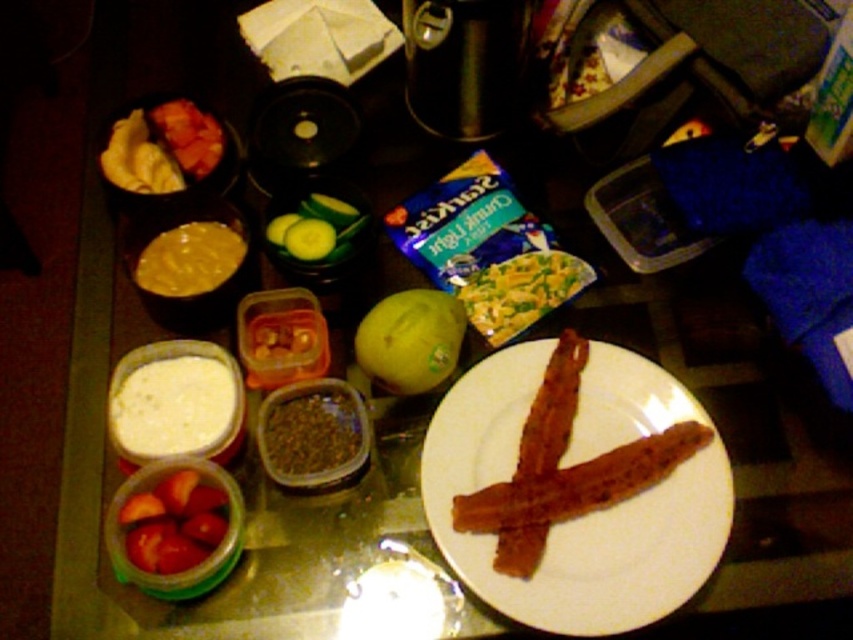
Who is higher up, yellow-green creamy pasta at center or yellow creamy sauce at center?

yellow creamy sauce at center is above.

Can you confirm if yellow-green creamy pasta at center is positioned to the right of yellow creamy sauce at center?

Correct, you'll find yellow-green creamy pasta at center to the right of yellow creamy sauce at center.

Between point (592, 282) and point (196, 292), which one is positioned in front?

Point (196, 292) is more forward.

The height and width of the screenshot is (640, 853). I want to click on yellow-green creamy pasta at center, so click(x=521, y=291).

Who is higher up, white creamy spread at lower left or yellow creamy sauce at center?

yellow creamy sauce at center is higher up.

Between white creamy spread at lower left and yellow creamy sauce at center, which one has more height?

Standing taller between the two is white creamy spread at lower left.

Which is in front, point (126, 440) or point (219, 257)?

Positioned in front is point (126, 440).

Locate an element on the screen. white creamy spread at lower left is located at coordinates (173, 404).

In the scene shown: Does green matte apple at center appear on the left side of shiny red tomatoes at lower left?

In fact, green matte apple at center is to the right of shiny red tomatoes at lower left.

Can you confirm if green matte apple at center is taller than shiny red tomatoes at lower left?

Yes.

Is point (425, 365) in front of point (117, 516)?

That is False.

The image size is (853, 640). I want to click on green matte apple at center, so click(x=410, y=340).